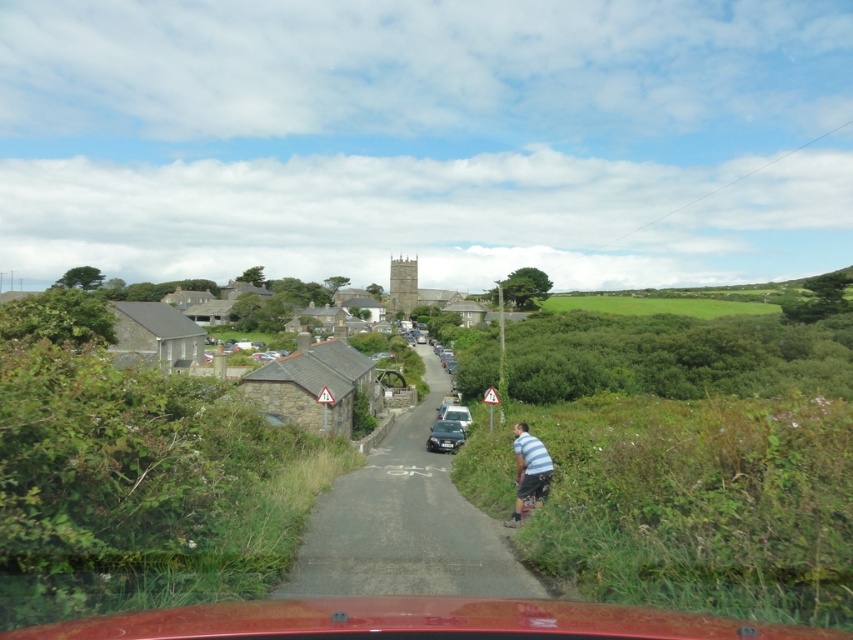
Question: Among these objects, which one is nearest to the camera?

Choices:
 (A) shiny silver car at center
 (B) striped cotton shirt at lower right
 (C) satin silver car at center
 (D) asphalt road at center

Answer: (D)

Question: Which point appears closest to the camera in this image?

Choices:
 (A) (439, 412)
 (B) (546, 468)
 (C) (421, 435)

Answer: (B)

Question: Can you confirm if striped cotton shirt at lower right is positioned above shiny silver car at center?

Choices:
 (A) yes
 (B) no

Answer: (A)

Question: Can you confirm if asphalt road at center is bigger than striped cotton shirt at lower right?

Choices:
 (A) no
 (B) yes

Answer: (B)

Question: Is asphalt road at center above striped cotton shirt at lower right?

Choices:
 (A) no
 (B) yes

Answer: (A)

Question: Which point appears closest to the camera in this image?

Choices:
 (A) (405, 490)
 (B) (463, 436)
 (C) (445, 413)

Answer: (A)